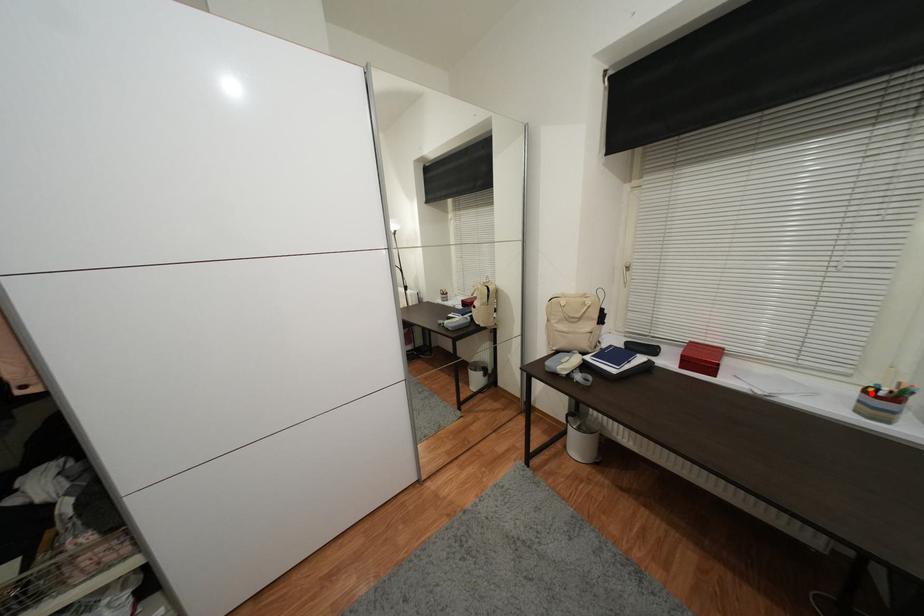
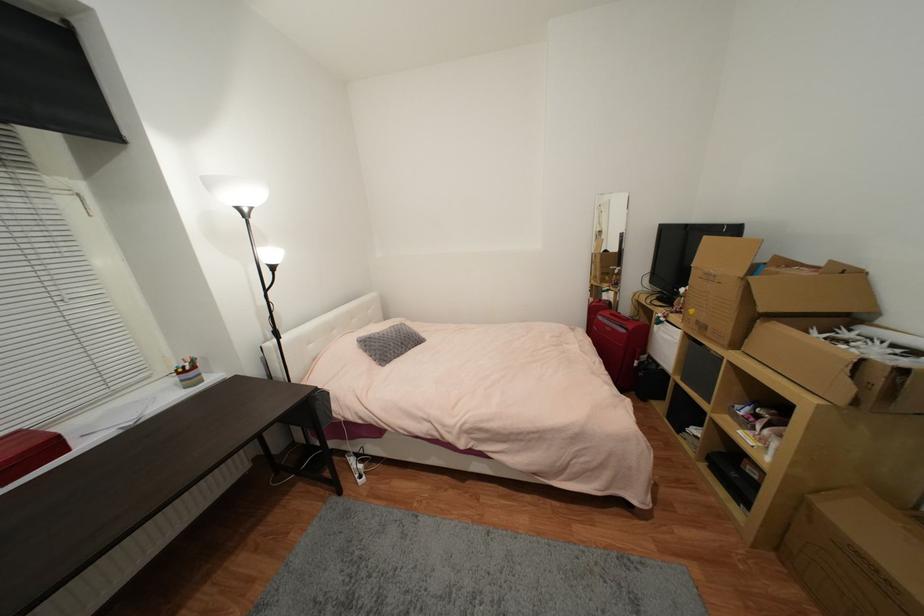
Question: I am providing you with two images of the same scene from different viewpoints. In image1, a red point is highlighted. Considering the same 3D point in image2, which of the following is correct?

Choices:
 (A) It is closer
 (B) It is farther

Answer: (A)